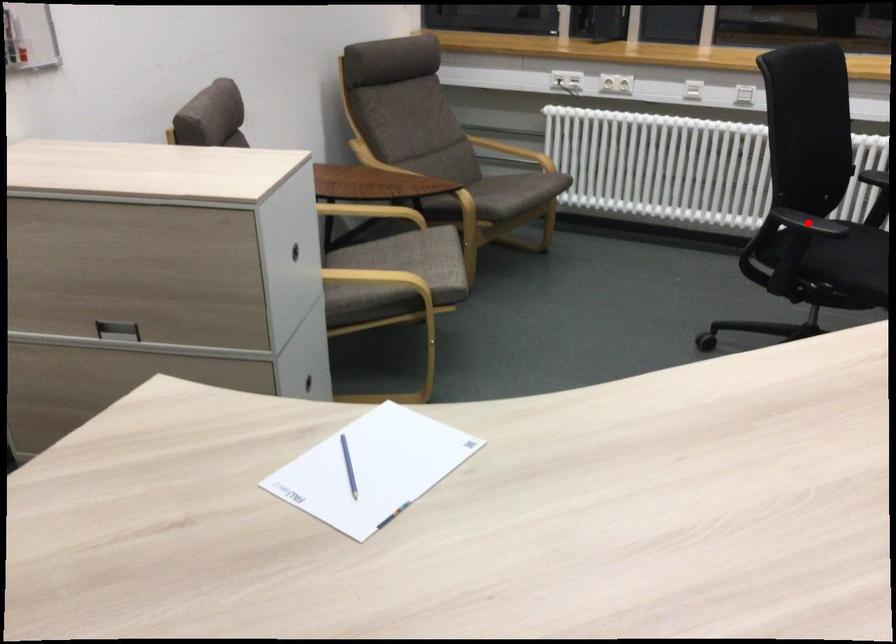
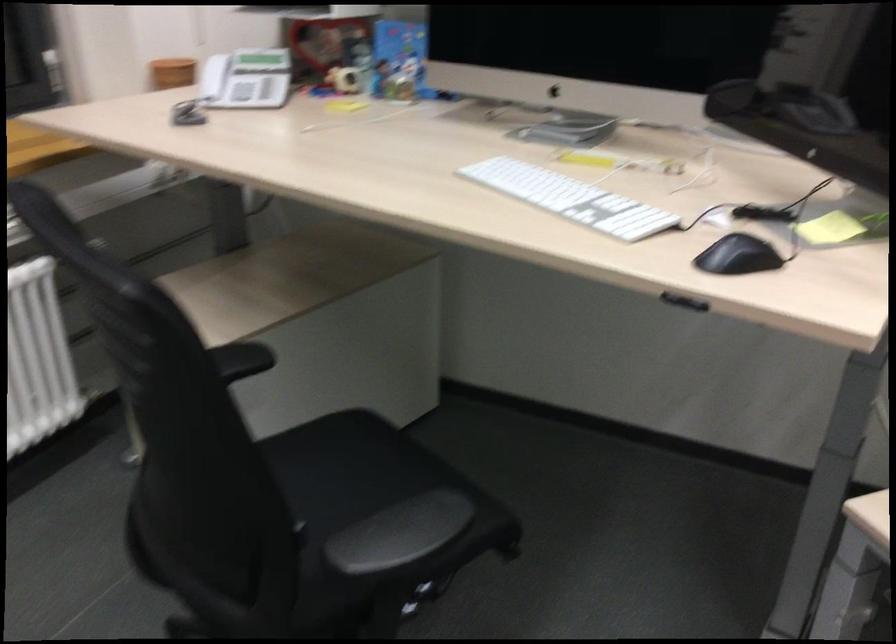
Find the pixel in the second image that matches the highlighted location in the first image.

(400, 534)